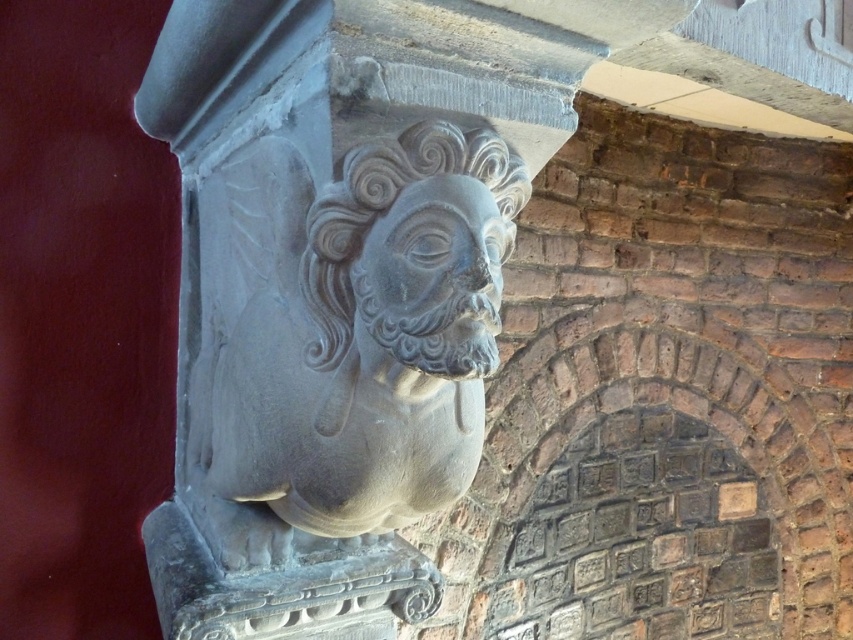
Is gray stone head at center positioned at the back of gray stone bust at center?

No, it is not.

Does point (456, 360) come behind point (355, 394)?

No, it is in front of (355, 394).

At what (x,y) coordinates should I click in order to perform the action: click on gray stone head at center. Please return your answer as a coordinate pair (x, y). Looking at the image, I should click on (343, 284).

Is gray stone bust at center further to camera compared to gray stone face at center?

No, gray stone bust at center is closer to the viewer.

Consider the image. Who is more distant from viewer, (463, 140) or (466, 304)?

The point (463, 140) is behind.

This screenshot has height=640, width=853. What do you see at coordinates (358, 326) in the screenshot?
I see `gray stone bust at center` at bounding box center [358, 326].

The image size is (853, 640). Identify the location of gray stone bust at center. (358, 326).

Does point (254, 292) lie behind point (434, 179)?

Yes, it is behind point (434, 179).

What do you see at coordinates (343, 284) in the screenshot? I see `gray stone head at center` at bounding box center [343, 284].

Find the location of a particular element. gray stone head at center is located at coordinates (343, 284).